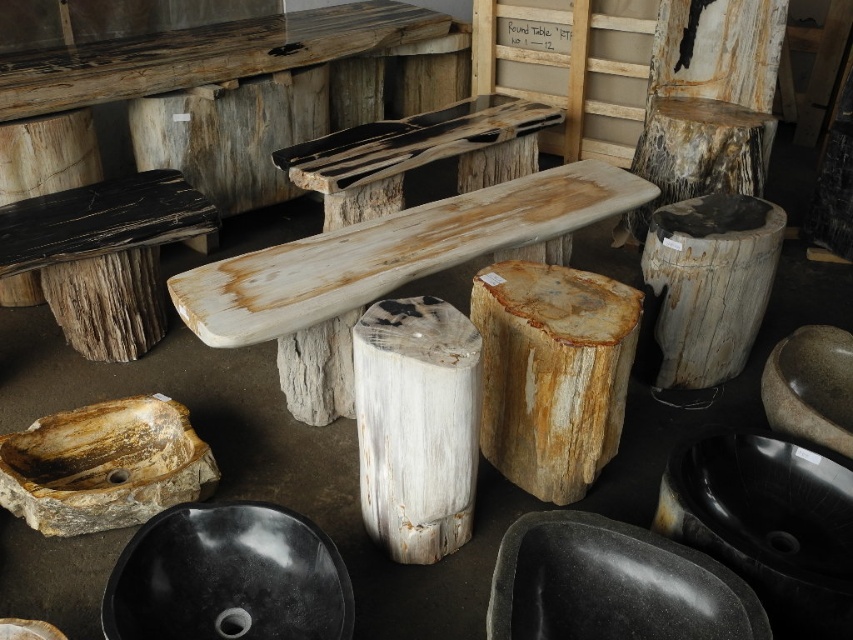
You are a furniture designer examining the image. You need to determine the vertical arrangement of the natural wood stump at center and the speckled wood stool at center. Which object is positioned lower in the scene?

The natural wood stump at center is positioned below the speckled wood stool at center, so it is lower in the scene.

You are a furniture designer examining the image. You need to place a decorative plate that is 12 inches wide on one of the stumps. Which stump between the natural wood stump at center and the speckled white wood stump at center can accommodate the plate without it hanging over the edge?

The speckled white wood stump at center has a greater width than the natural wood stump at center, so the decorative plate that is 12 inches wide can be placed on the speckled white wood stump at center without hanging over the edge.

What are the coordinates of the natural wood stump at center?

The natural wood stump at center is located at coordinates point (552, 372).